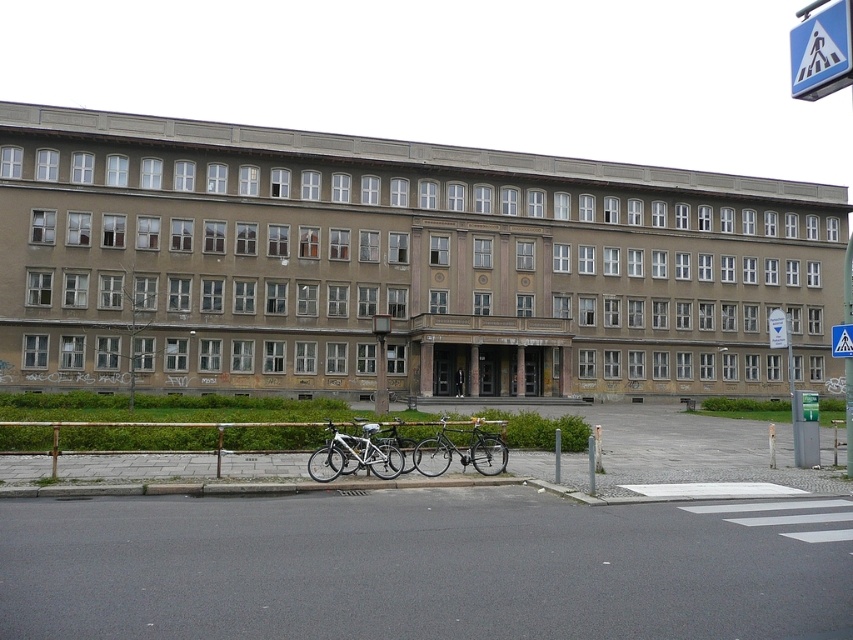
Measure the distance between white plastic pedestrian crossing sign at upper right and white matte bicycle at lower center.

white plastic pedestrian crossing sign at upper right is 17.34 meters away from white matte bicycle at lower center.

Does point (834, 65) come in front of point (338, 452)?

No.

Which is behind, point (807, 58) or point (325, 461)?

Point (325, 461)

Find the location of a particular element. The width and height of the screenshot is (853, 640). white plastic pedestrian crossing sign at upper right is located at coordinates click(821, 51).

Is shiny silver bicycle at center to the left of silver metallic bicycle at center from the viewer's perspective?

No, shiny silver bicycle at center is not to the left of silver metallic bicycle at center.

Is shiny silver bicycle at center closer to the viewer compared to silver metallic bicycle at center?

That is False.

Which is in front, point (419, 445) or point (404, 442)?

Point (419, 445) is in front.

Find the location of a particular element. The width and height of the screenshot is (853, 640). shiny silver bicycle at center is located at coordinates (460, 451).

Which of these two, white matte bicycle at lower center or shiny silver bicycle at center, stands taller?

white matte bicycle at lower center

Which is behind, point (325, 481) or point (428, 476)?

Point (428, 476)

Is point (340, 460) less distant than point (444, 465)?

Yes, point (340, 460) is in front of point (444, 465).

Image resolution: width=853 pixels, height=640 pixels. I want to click on white matte bicycle at lower center, so click(x=354, y=456).